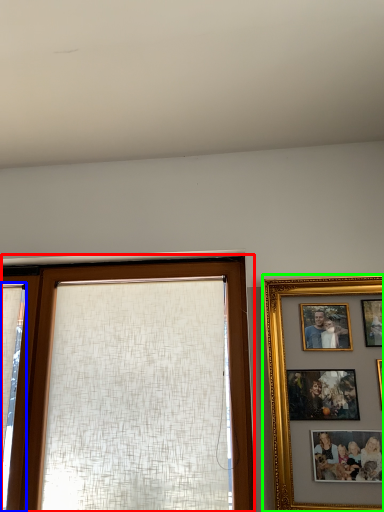
Question: Based on their relative distances, which object is nearer to window (highlighted by a red box)? Choose from curtain (highlighted by a blue box) and picture frame (highlighted by a green box).

Choices:
 (A) curtain
 (B) picture frame

Answer: (A)